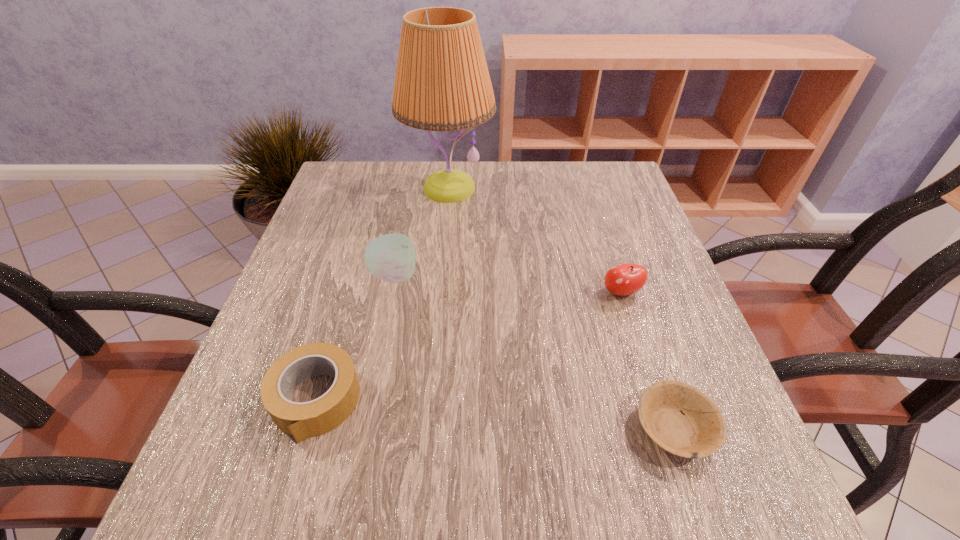
I want to click on vacant space that satisfies the following two spatial constraints: 1. on the side of the farthest object near the pull switch; 2. on the left side of the third tallest object, so click(439, 293).

You are a GUI agent. You are given a task and a screenshot of the screen. Output one action in this format:
    pyautogui.click(x=<x>, y=<y>)
    Task: Click on the free spot that satisfies the following two spatial constraints: 1. on the side of the tallest object near the pull switch; 2. on the right side of the bowl
    The width and height of the screenshot is (960, 540).
    Given the screenshot: What is the action you would take?
    pyautogui.click(x=426, y=428)